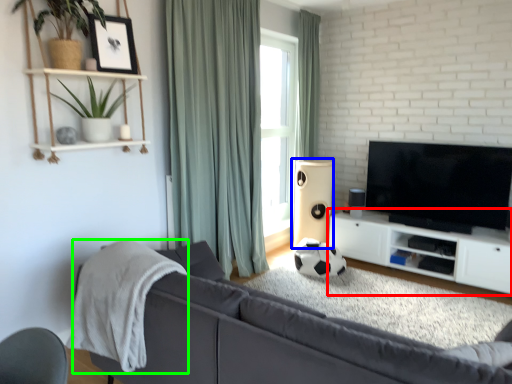
Question: Estimate the real-world distances between objects in this image. Which object is closer to cabinetry (highlighted by a red box), speaker (highlighted by a blue box) or blanket (highlighted by a green box)?

Choices:
 (A) speaker
 (B) blanket

Answer: (A)